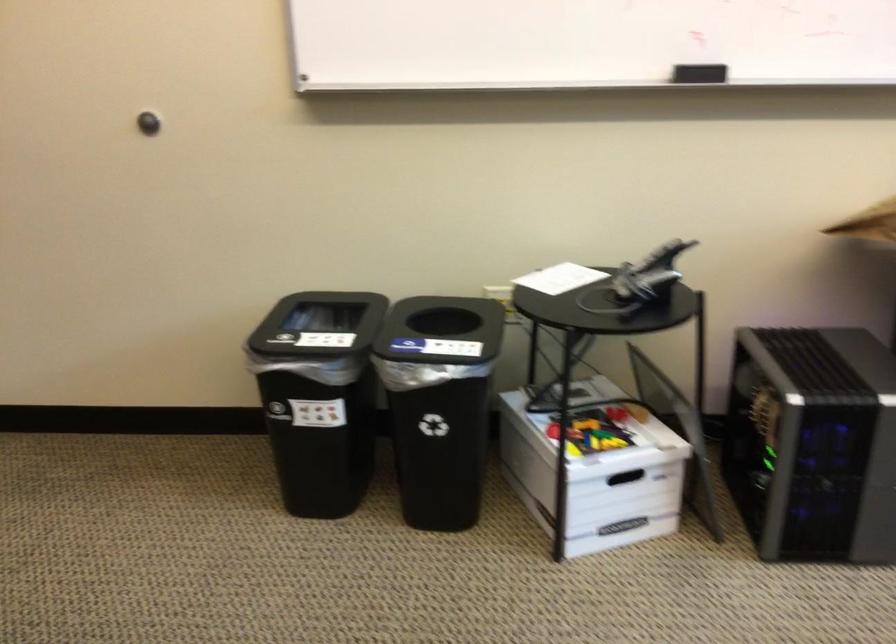
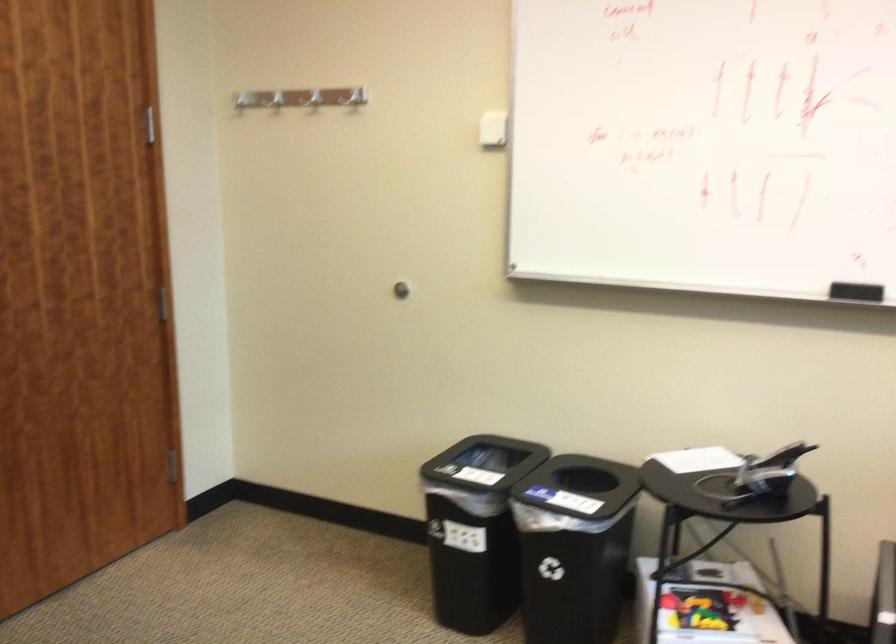
Where in the second image is the point corresponding to point 595,430 from the first image?

(701, 609)